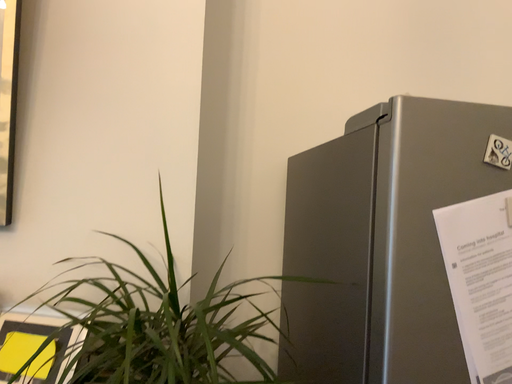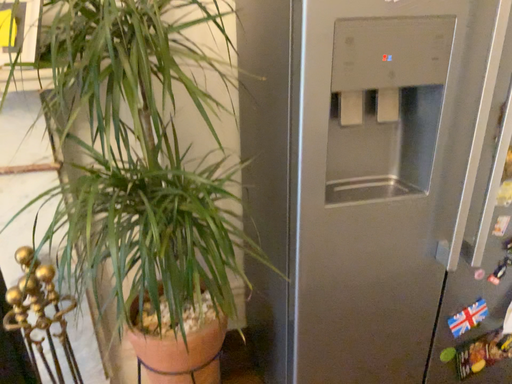
Question: Which way did the camera rotate in the video?

Choices:
 (A) rotated upward
 (B) rotated downward

Answer: (B)